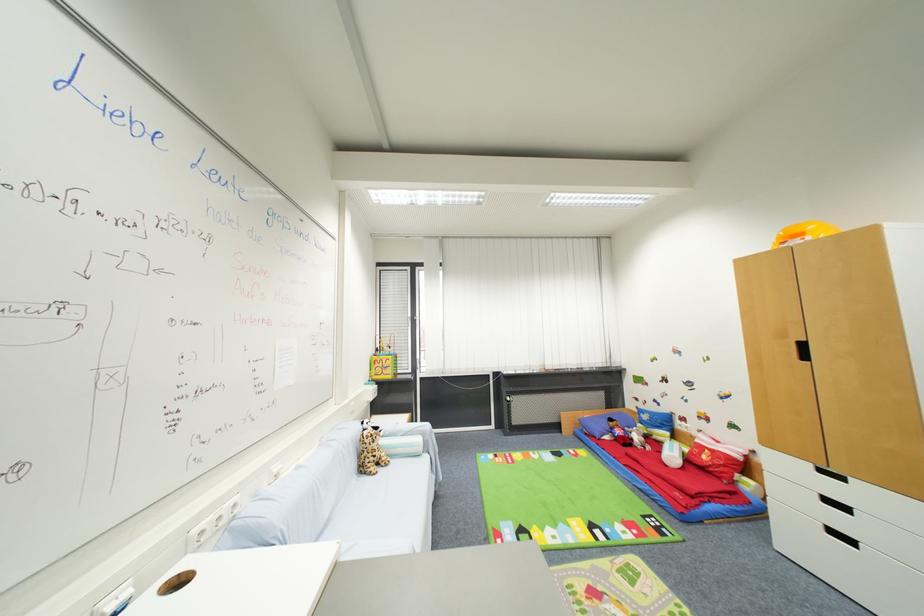
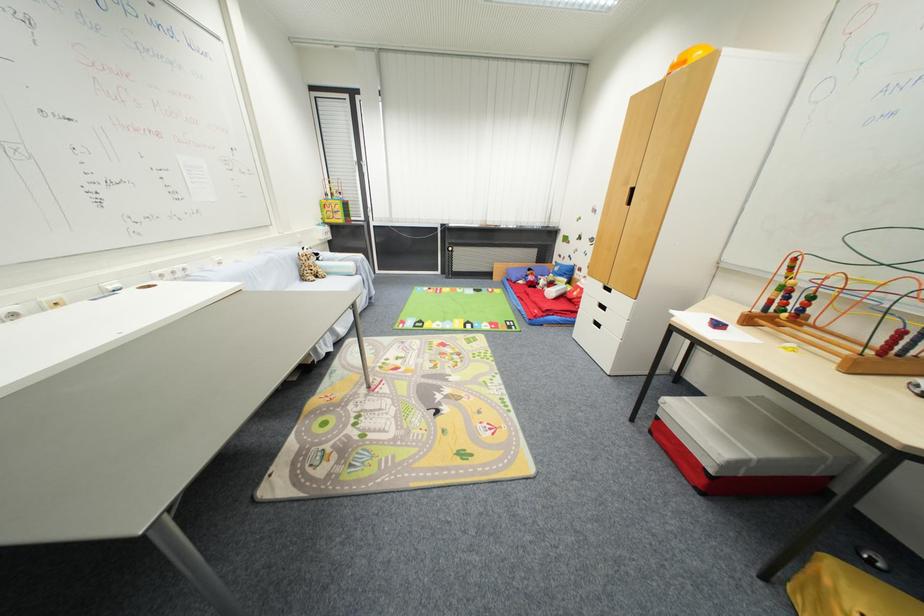
The point at (359, 466) is marked in the first image. Where is the corresponding point in the second image?

(300, 276)